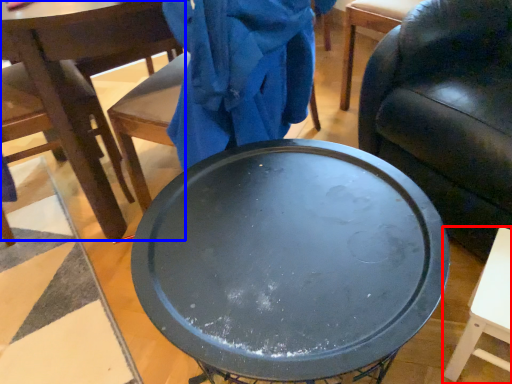
Question: Which object is further to the camera taking this photo, table (highlighted by a red box) or chair (highlighted by a blue box)?

Choices:
 (A) table
 (B) chair

Answer: (B)